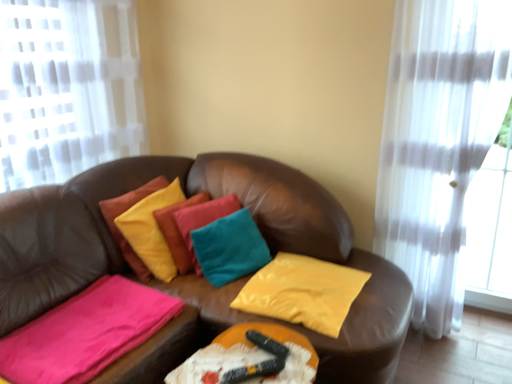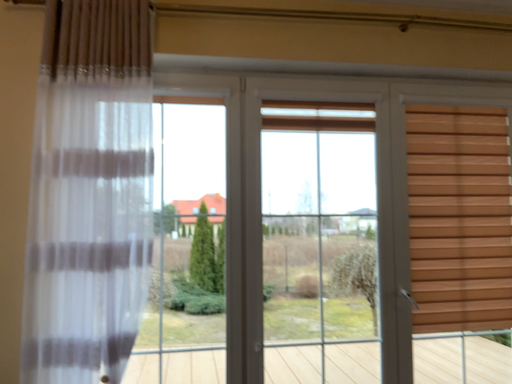
Question: Which way did the camera rotate in the video?

Choices:
 (A) rotated upward
 (B) rotated downward

Answer: (A)